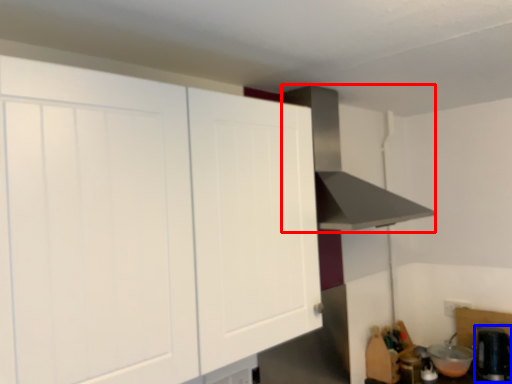
Question: Which of the following is the closest to the observer, vent (highlighted by a red box) or appliance (highlighted by a blue box)?

Choices:
 (A) vent
 (B) appliance

Answer: (A)